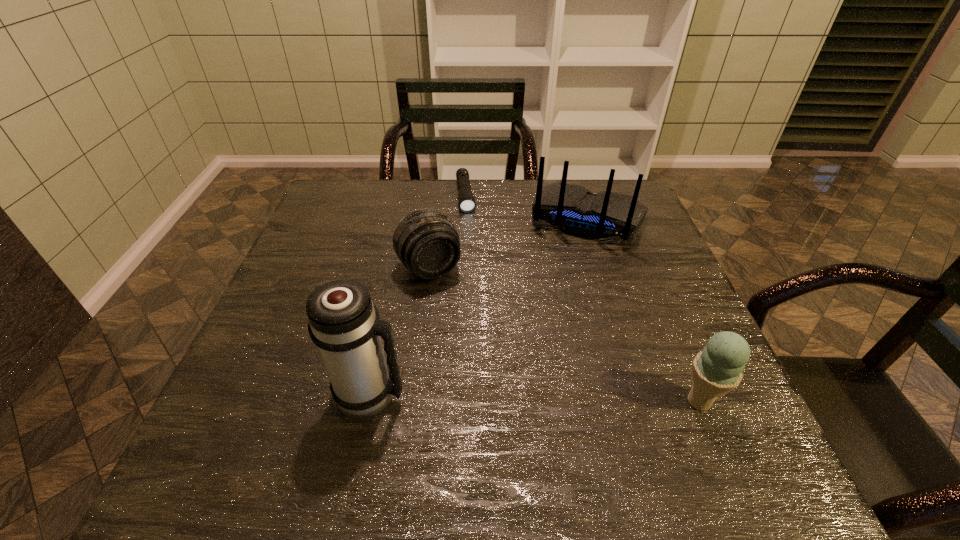
Identify the location of ice cream that is at the right edge. Image resolution: width=960 pixels, height=540 pixels. (716, 370).

Locate an element on the screen. router that is at the right edge is located at coordinates (572, 209).

Image resolution: width=960 pixels, height=540 pixels. I want to click on object that is positioned at the far right corner, so click(x=572, y=209).

Identify the location of object present at the near right corner. (716, 370).

You are a GUI agent. You are given a task and a screenshot of the screen. Output one action in this format:
    pyautogui.click(x=<x>, y=<y>)
    Task: Click on the vacant space at the far edge of the desktop
    
    Given the screenshot: What is the action you would take?
    pyautogui.click(x=416, y=184)

Where is `vacant region at the near edge`? vacant region at the near edge is located at coordinates (465, 402).

At what (x,y) coordinates should I click in order to perform the action: click on vacant space at the left edge of the desktop. Please return your answer as a coordinate pair (x, y). This screenshot has height=540, width=960. Looking at the image, I should click on (333, 256).

Identify the location of free space at the right edge. (632, 280).

Locate an element on the screen. Image resolution: width=960 pixels, height=540 pixels. vacant point at the far left corner is located at coordinates (336, 184).

This screenshot has width=960, height=540. Find the location of `vacant space at the near right corner of the desktop`. vacant space at the near right corner of the desktop is located at coordinates (732, 417).